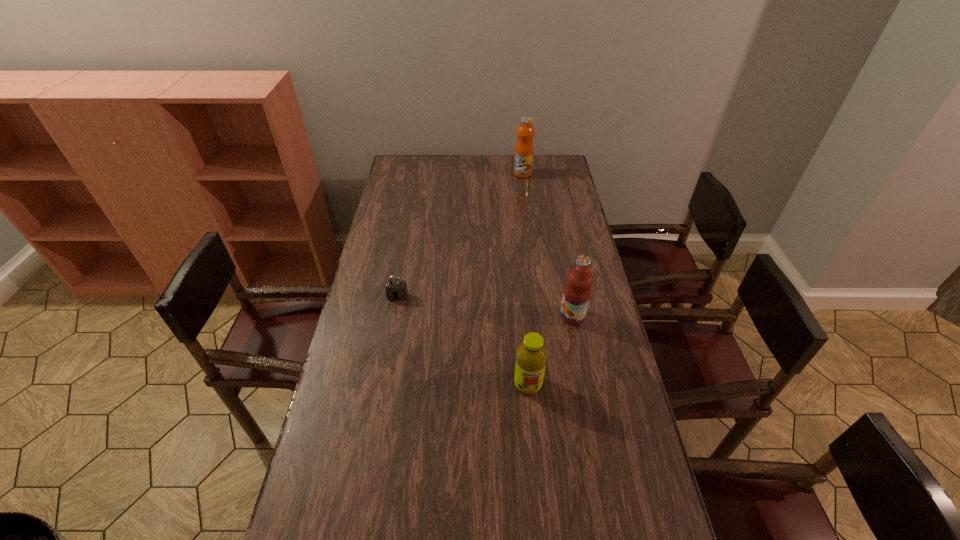
Point out which object is positioned as the second nearest to the third farthest object. Please provide its 2D coordinates. Your answer should be formatted as a tuple, i.e. [(x, y)], where the tuple contains the x and y coordinates of a point satisfying the conditions above.

[(396, 290)]

At what (x,y) coordinates should I click in order to perform the action: click on object that stands as the third closest to the farthest object. Please return your answer as a coordinate pair (x, y). The height and width of the screenshot is (540, 960). Looking at the image, I should click on (531, 356).

Identify the location of fruit juice that is the second closest to the farthest object. The width and height of the screenshot is (960, 540). (531, 356).

The width and height of the screenshot is (960, 540). I want to click on the closest fruit juice to the farthest object, so click(577, 291).

Where is `vacant area in the image that satisfies the following two spatial constraints: 1. on the front label of the second nearest fruit juice; 2. on the front label of the nearest fruit juice`? vacant area in the image that satisfies the following two spatial constraints: 1. on the front label of the second nearest fruit juice; 2. on the front label of the nearest fruit juice is located at coordinates (586, 384).

Where is `free location that satisfies the following two spatial constraints: 1. on the front label of the rightmost object; 2. on the front label of the nearest object`? This screenshot has height=540, width=960. free location that satisfies the following two spatial constraints: 1. on the front label of the rightmost object; 2. on the front label of the nearest object is located at coordinates (586, 384).

Where is `free point that satisfies the following two spatial constraints: 1. on the front label of the second nearest object; 2. on the front label of the third tallest object`? The width and height of the screenshot is (960, 540). free point that satisfies the following two spatial constraints: 1. on the front label of the second nearest object; 2. on the front label of the third tallest object is located at coordinates (586, 384).